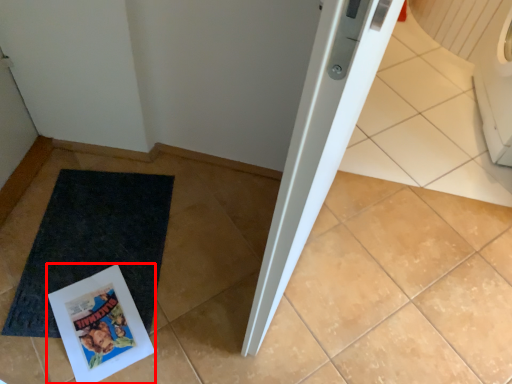
Question: Where is comic book (annotated by the red box) located in relation to mat in the image?

Choices:
 (A) right
 (B) left

Answer: (A)